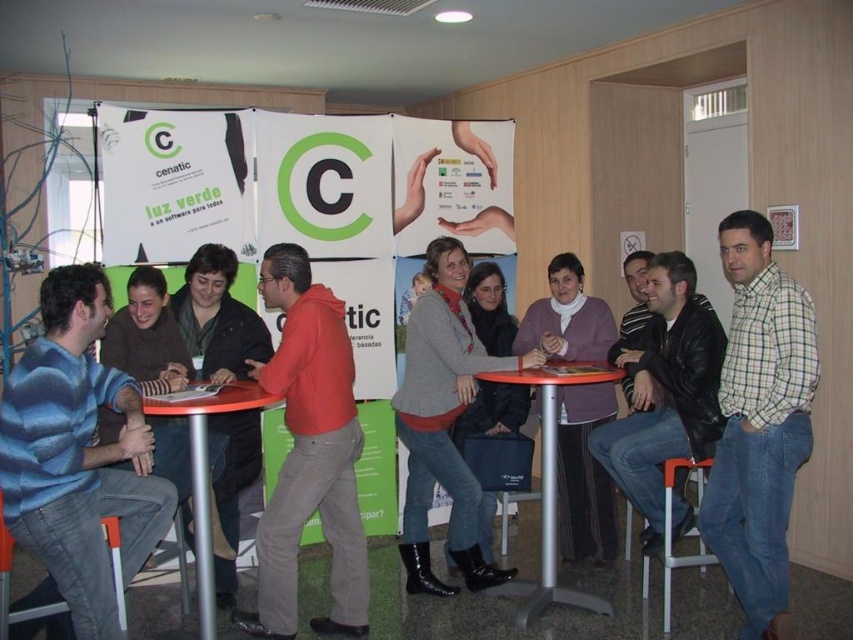
In the scene shown: Does reddish-orange hoodie at center come behind metallic silver table at center?

Yes, reddish-orange hoodie at center is further from the viewer.

What do you see at coordinates (218, 316) in the screenshot? The image size is (853, 640). I see `reddish-orange hoodie at center` at bounding box center [218, 316].

Between point (229, 499) and point (173, 401), which one is positioned behind?

The point (229, 499) is behind.

Locate an element on the screen. reddish-orange hoodie at center is located at coordinates (218, 316).

Is checkered shirt at right closer to the viewer compared to orange plastic stool at lower right?

Yes.

Measure the distance from checkered shirt at right to orange plastic stool at lower right.

checkered shirt at right is 17.33 inches from orange plastic stool at lower right.

Who is more distant from viewer, (756, 257) or (701, 461)?

Point (701, 461)

Find the location of `checkered shirt at right`. checkered shirt at right is located at coordinates (x=759, y=422).

Which is more to the right, matte gray sweater at center or matte plastic table at center?

matte plastic table at center is more to the right.

Who is taller, matte gray sweater at center or matte plastic table at center?

matte gray sweater at center

Identify the location of matte gray sweater at center. (444, 420).